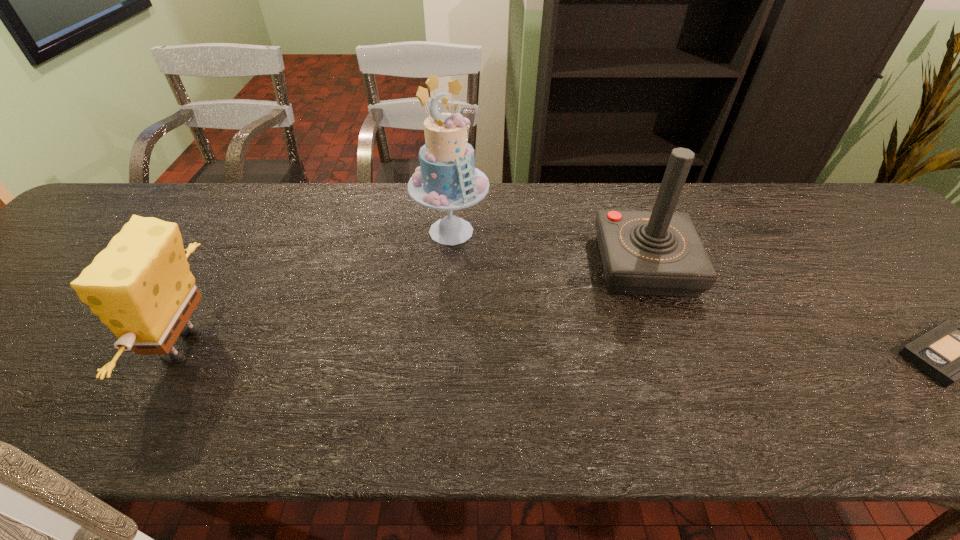
This screenshot has height=540, width=960. Find the location of `free space on the desktop that is between the leftmost object and the shortest object and is positioned with a ladder on the side of the second object from left to right`. free space on the desktop that is between the leftmost object and the shortest object and is positioned with a ladder on the side of the second object from left to right is located at coordinates (465, 349).

Where is `vacant spot on the desktop that is between the leftmost object and the shortest object and is positioned on the rectangular base of the third object from left to right`? This screenshot has height=540, width=960. vacant spot on the desktop that is between the leftmost object and the shortest object and is positioned on the rectangular base of the third object from left to right is located at coordinates (670, 352).